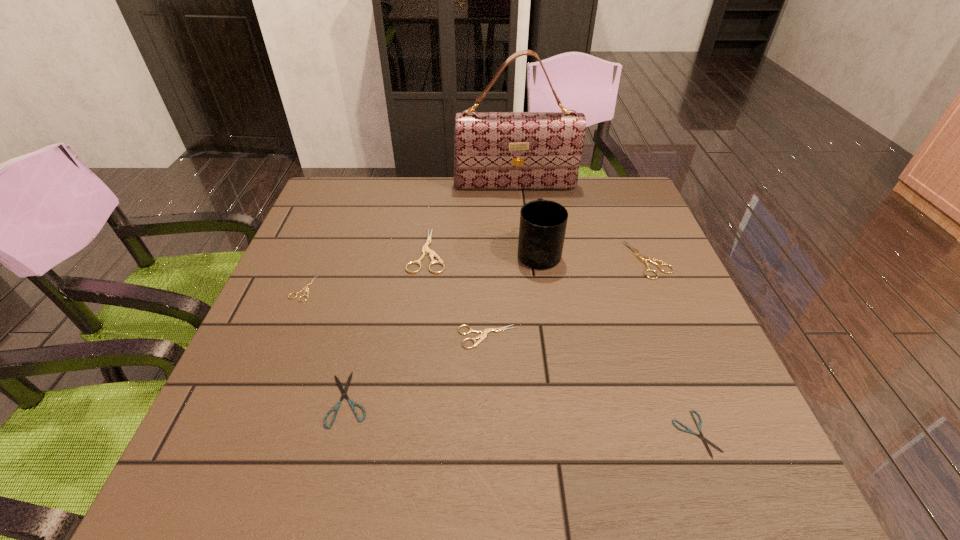
This screenshot has height=540, width=960. In order to click on the farthest object in this screenshot , I will do `click(492, 150)`.

The width and height of the screenshot is (960, 540). I want to click on brown handbag, so click(x=492, y=150).

Locate an element on the screen. The height and width of the screenshot is (540, 960). black mug is located at coordinates click(x=543, y=223).

The height and width of the screenshot is (540, 960). In order to click on mug in this screenshot , I will do `click(543, 223)`.

The width and height of the screenshot is (960, 540). In order to click on the third object from left to right in this screenshot , I will do `click(425, 250)`.

This screenshot has height=540, width=960. In order to click on the biggest beige shears in this screenshot , I will do `click(425, 250)`.

Find the location of a particular element. This screenshot has height=540, width=960. the second tallest shears is located at coordinates (644, 259).

The height and width of the screenshot is (540, 960). I want to click on the rightmost beige shears, so click(644, 259).

Locate an element on the screen. the third tallest shears is located at coordinates (484, 332).

Locate an element on the screen. This screenshot has width=960, height=540. the third shears from right to left is located at coordinates pos(484,332).